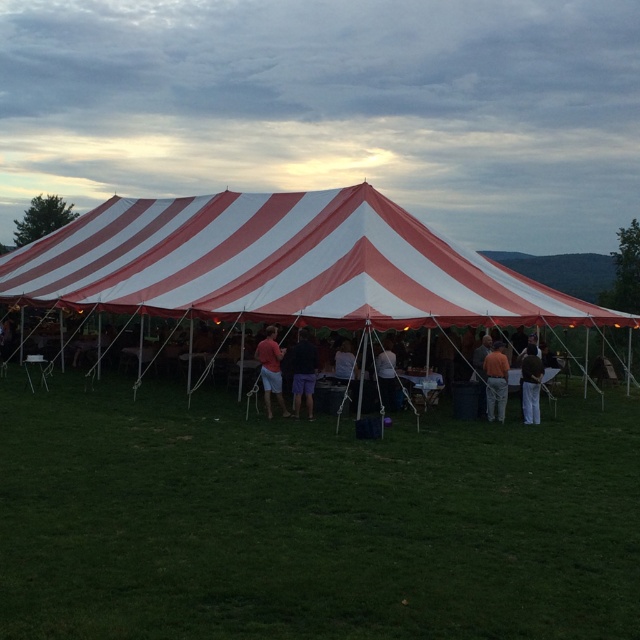
Question: Which point appears farthest from the camera in this image?

Choices:
 (A) (268, 336)
 (B) (392, 365)
 (C) (160, 502)

Answer: (B)

Question: Which object is positioned farthest from the white matte tent at center?

Choices:
 (A) matte black shirt at center
 (B) orange cotton shirt at center

Answer: (B)

Question: Does white striped tent at center have a smaller size compared to white matte tent at center?

Choices:
 (A) yes
 (B) no

Answer: (B)

Question: From the image, what is the correct spatial relationship of white striped tent at center in relation to brown fabric pants at right?

Choices:
 (A) below
 (B) above

Answer: (B)

Question: Is matte red shirt at center wider than matte black shirt at center?

Choices:
 (A) no
 (B) yes

Answer: (B)

Question: Among these points, which one is farthest from the camera?

Choices:
 (A) (394, 376)
 (B) (528, 369)
 (C) (348, 372)

Answer: (C)